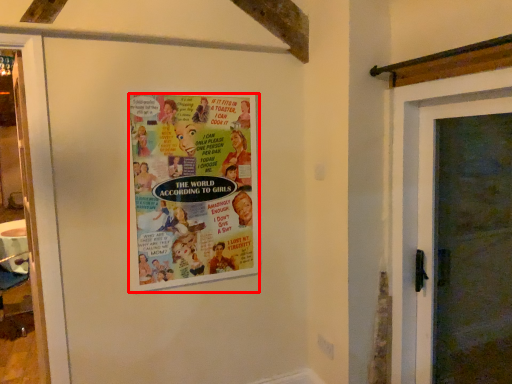
Question: Considering the relative positions of poster (annotated by the red box) and door in the image provided, where is poster (annotated by the red box) located with respect to the staircase?

Choices:
 (A) right
 (B) left

Answer: (B)